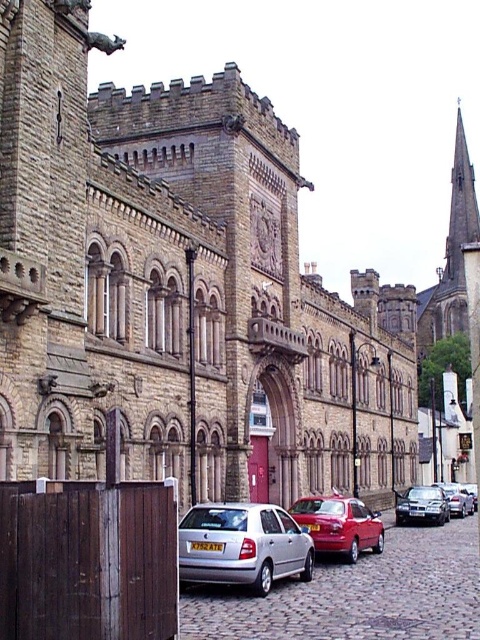
Between silver metallic hatchback at lower center and metallic silver car at center, which one appears on the right side from the viewer's perspective?

metallic silver car at center is more to the right.

The image size is (480, 640). Find the location of `silver metallic hatchback at lower center`. silver metallic hatchback at lower center is located at coordinates (242, 545).

Does silver metallic hatchback at lower center appear under silver metallic car at right?

Incorrect, silver metallic hatchback at lower center is not positioned below silver metallic car at right.

Is silver metallic hatchback at lower center positioned in front of silver metallic car at right?

Yes, silver metallic hatchback at lower center is closer to the viewer.

The width and height of the screenshot is (480, 640). What do you see at coordinates (242, 545) in the screenshot?
I see `silver metallic hatchback at lower center` at bounding box center [242, 545].

You are a GUI agent. You are given a task and a screenshot of the screen. Output one action in this format:
    pyautogui.click(x=<x>, y=<y>)
    Task: Click on the silver metallic hatchback at lower center
    
    Given the screenshot: What is the action you would take?
    pyautogui.click(x=242, y=545)

Is shiny red car at center further to camera compared to silver metallic car at right?

No, it is in front of silver metallic car at right.

Does shiny red car at center appear on the left side of silver metallic car at right?

Indeed, shiny red car at center is positioned on the left side of silver metallic car at right.

Which is behind, point (365, 525) or point (465, 496)?

Positioned behind is point (465, 496).

At what (x,y) coordinates should I click in order to perform the action: click on shiny red car at center. Please return your answer as a coordinate pair (x, y). The width and height of the screenshot is (480, 640). Looking at the image, I should click on (338, 524).